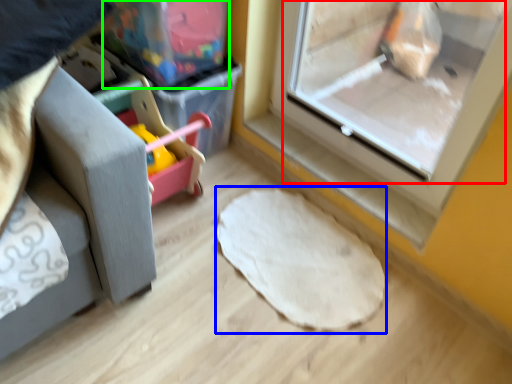
Question: Which object is the farthest from screen door (highlighted by a red box)? Choose among these: mat (highlighted by a blue box) or storage box (highlighted by a green box).

Choices:
 (A) mat
 (B) storage box

Answer: (B)